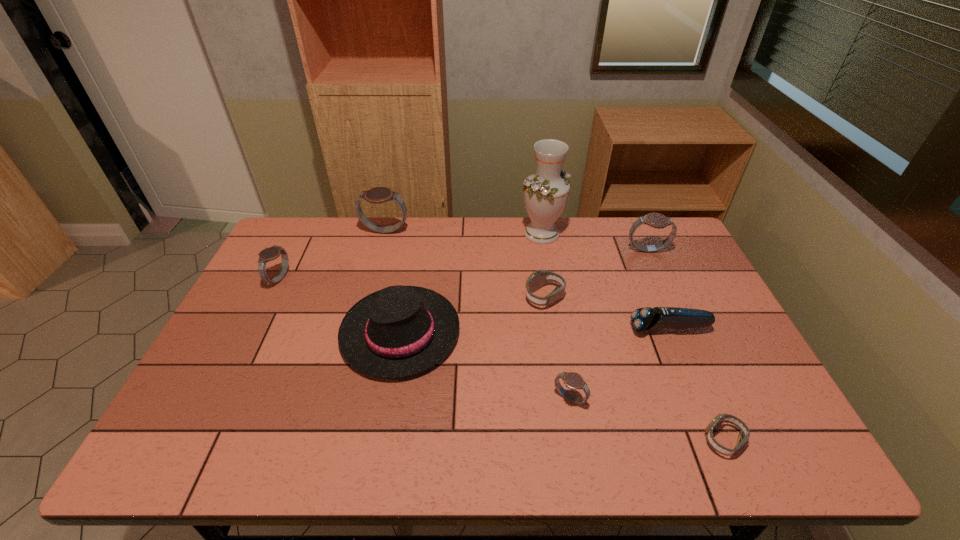
At what (x,y) coordinates should I click in order to perform the action: click on vase positioned at the far edge. Please return your answer as a coordinate pair (x, y). Looking at the image, I should click on (243, 412).

The height and width of the screenshot is (540, 960). In order to click on object located at the near edge in this screenshot , I will do `click(243, 412)`.

At what (x,y) coordinates should I click in order to perform the action: click on object located at the left edge. Please return your answer as a coordinate pair (x, y). Image resolution: width=960 pixels, height=540 pixels. Looking at the image, I should click on click(243, 412).

At what (x,y) coordinates should I click in order to perform the action: click on electric shaver present at the right edge. Please return your answer as a coordinate pair (x, y). The width and height of the screenshot is (960, 540). Looking at the image, I should click on (243, 412).

Find the location of a particular element. This screenshot has height=540, width=960. object present at the far right corner is located at coordinates (243, 412).

Image resolution: width=960 pixels, height=540 pixels. I want to click on object at the near right corner, so click(243, 412).

Image resolution: width=960 pixels, height=540 pixels. What are the coordinates of `object that is the fourth closest to the vase` in the screenshot? It's located at (243, 412).

This screenshot has height=540, width=960. In order to click on the second closest object to the bigger white watch in this screenshot , I will do `click(243, 412)`.

Select which watch appears as the sixth closest to the electric shaver. Please provide its 2D coordinates. Your answer should be formatted as a tuple, i.e. [(x, y)], where the tuple contains the x and y coordinates of a point satisfying the conditions above.

[(243, 412)]

This screenshot has width=960, height=540. In order to click on watch that is the third closest to the tallest object in this screenshot , I will do `click(243, 412)`.